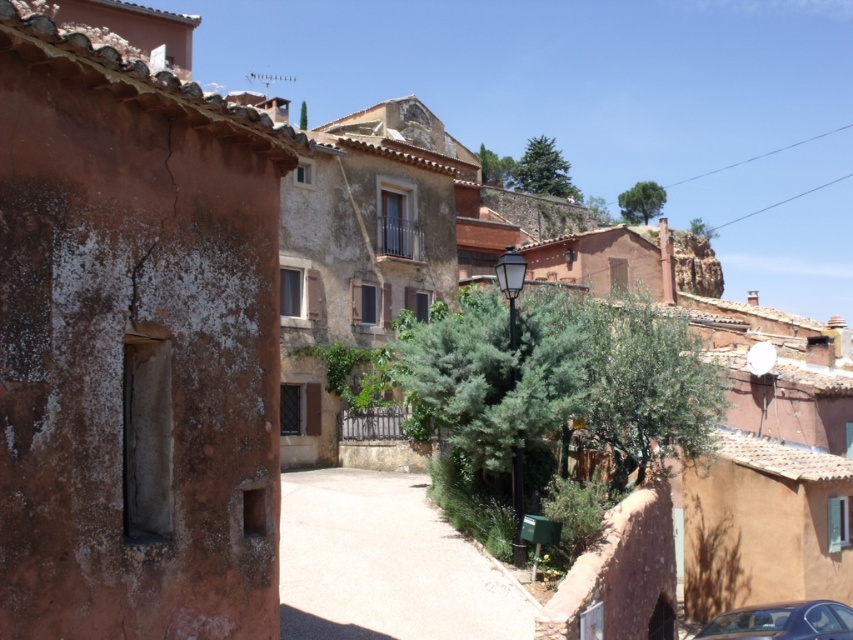
Is smooth concrete path at center smaller than metallic silver car at lower right?

Incorrect, smooth concrete path at center is not smaller in size than metallic silver car at lower right.

Looking at this image, is smooth concrete path at center above metallic silver car at lower right?

Yes, smooth concrete path at center is above metallic silver car at lower right.

Find the location of a particular element. The height and width of the screenshot is (640, 853). smooth concrete path at center is located at coordinates (384, 564).